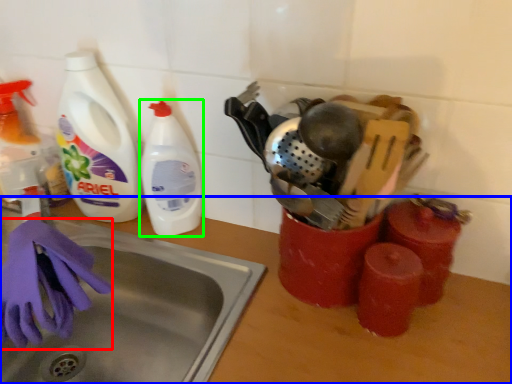
Question: Which object is positioned closest to glove (highlighted by a red box)? Select from counter top (highlighted by a blue box) and cleaning product (highlighted by a green box).

Choices:
 (A) counter top
 (B) cleaning product

Answer: (B)